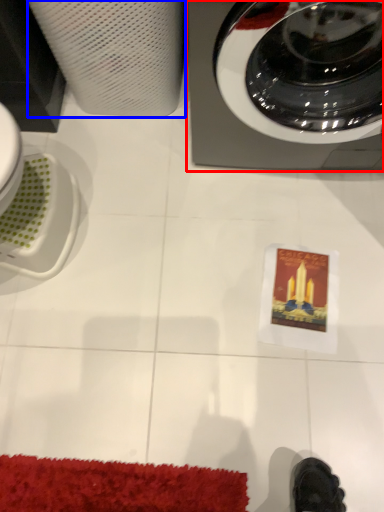
Question: Which point is further to the camera, home appliance (highlighted by a red box) or paper towel (highlighted by a blue box)?

Choices:
 (A) home appliance
 (B) paper towel

Answer: (B)